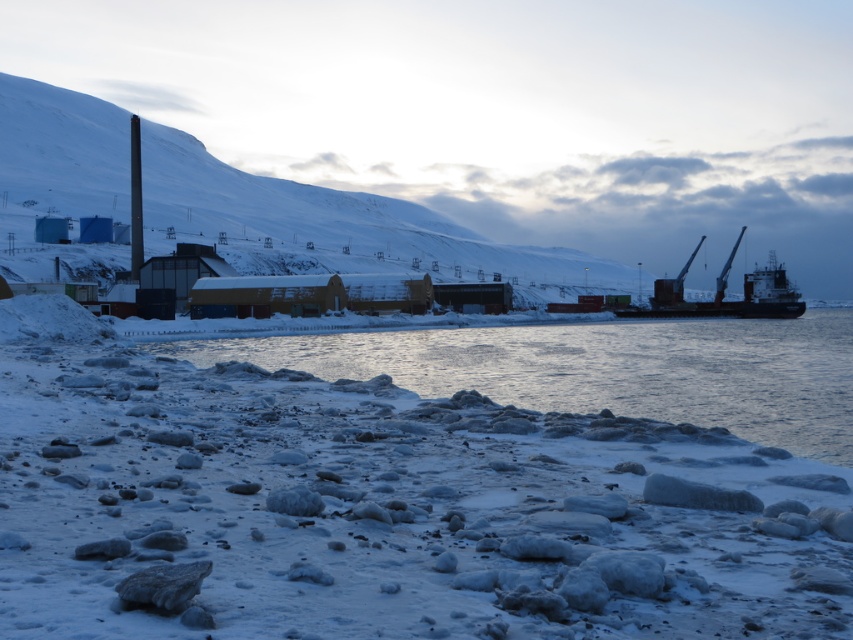
You are standing at the port and want to cross to the ship using a bridge that is 60 feet long. The clear ice water at lower center is between you and the ship. Can you safely cross the bridge without the water being too close?

The clear ice water at lower center is 58.87 feet away from the viewer. Since the bridge is 60 feet long, it is long enough to safely cross over the clear ice water at lower center without the water being too close.

You are a delivery truck driver who needs to deliver packages to the dark gray metallic ship at right. You are currently parked on the white frosty snow at lower left. The road between them is clear of obstacles. Can you drive directly to the ship without detouring around the snow?

The white frosty snow at lower left is 133.84 meters away from dark gray metallic ship at right. Since the road is clear, you can drive directly to the ship without needing to detour around the snow.

You are a delivery driver who needs to park your truck near the white frosty snow at lower left and the dark gray metallic ship at right. Which object is closer to the parking lot entrance located at the center of the image?

The white frosty snow at lower left is closer to the parking lot entrance located at the center of the image than the dark gray metallic ship at right.